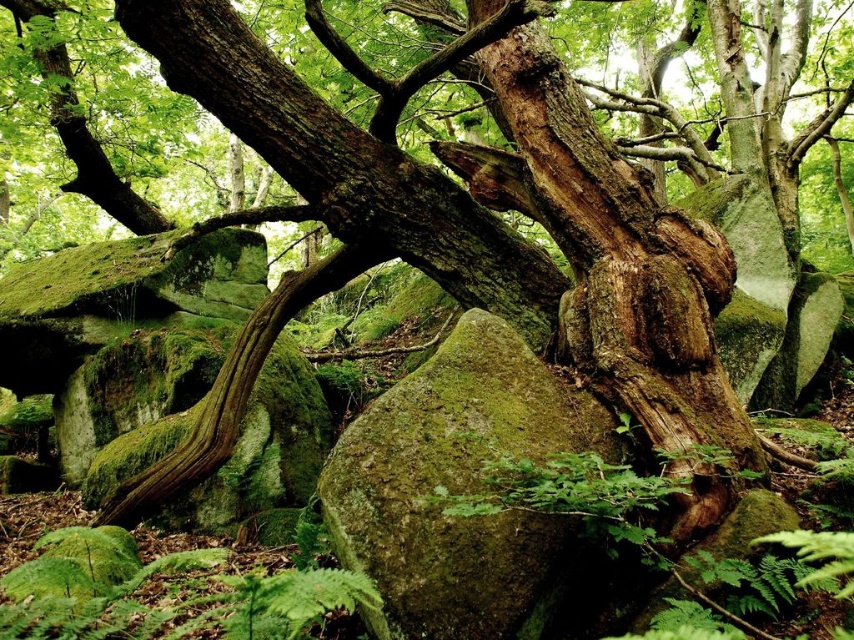
Question: Is green mossy rock at center wider than green fuzzy fern at lower left?

Choices:
 (A) no
 (B) yes

Answer: (A)

Question: Among these points, which one is nearest to the camera?

Choices:
 (A) (559, 442)
 (B) (322, 586)

Answer: (B)

Question: Where is green mossy rock at center located in relation to green fuzzy fern at lower left in the image?

Choices:
 (A) left
 (B) right

Answer: (B)

Question: Is green mossy rock at center closer to camera compared to green fuzzy fern at lower left?

Choices:
 (A) yes
 (B) no

Answer: (B)